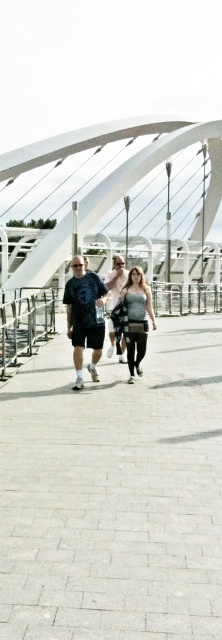
Question: Among these points, which one is farthest from the camera?

Choices:
 (A) (93, 284)
 (B) (156, 147)
 (C) (65, 564)
 (D) (89, 346)

Answer: (B)

Question: Which of the following is the farthest from the observer?

Choices:
 (A) white glossy pedestrian bridge at center
 (B) matte black t-shirt at center
 (C) matte black shorts at center
 (D) light gray concrete sidewalk at center

Answer: (A)

Question: Is white glossy pedestrian bridge at center positioned in front of matte black shorts at center?

Choices:
 (A) no
 (B) yes

Answer: (A)

Question: Which object is farther from the camera taking this photo?

Choices:
 (A) matte gray tank top at center
 (B) white glossy pedestrian bridge at center
 (C) matte black t-shirt at center
 (D) matte black shorts at center

Answer: (B)

Question: Is the position of light gray concrete sidewalk at center less distant than that of light pink cotton shirt at center?

Choices:
 (A) yes
 (B) no

Answer: (A)

Question: Does matte black t-shirt at center appear on the right side of light pink cotton shirt at center?

Choices:
 (A) yes
 (B) no

Answer: (B)